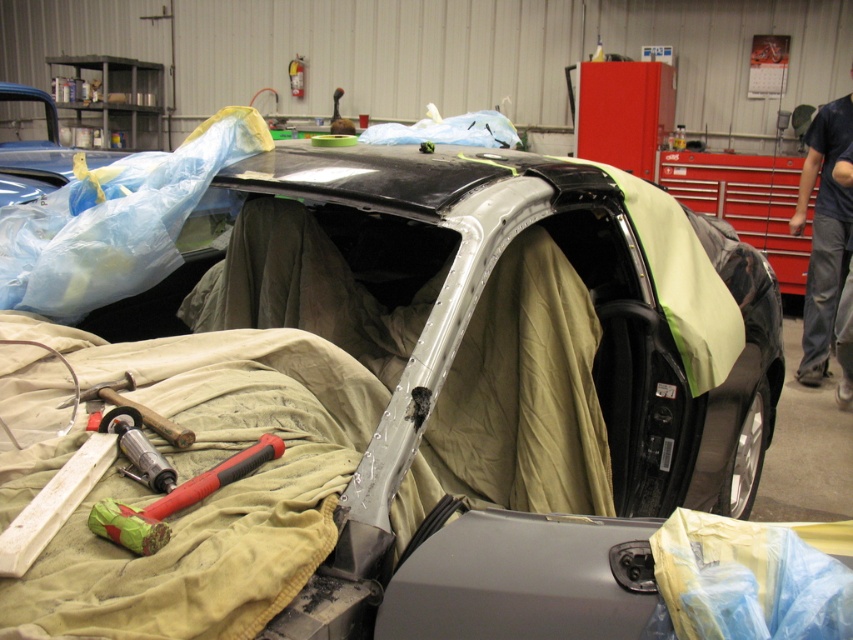
Does point (282, 205) come farther from viewer compared to point (119, 429)?

That is True.

Which is in front, point (576, 253) or point (155, 476)?

Point (155, 476)

This screenshot has height=640, width=853. Identify the location of metallic silver car at center. coord(498,314).

Can you confirm if metallic silver car at center is positioned below red rubber hammer at lower left?

No, metallic silver car at center is not below red rubber hammer at lower left.

Is point (743, 403) behind point (248, 452)?

That is True.

Based on the photo, who is more distant from viewer, (306, 260) or (140, 541)?

Positioned behind is point (306, 260).

Identify the location of metallic silver car at center. This screenshot has height=640, width=853. (498, 314).

Which is in front, point (189, 500) or point (172, 483)?

Point (189, 500)

Which is in front, point (236, 464) or point (138, 472)?

Point (138, 472) is more forward.

Identify the location of red rubber hammer at lower left. (175, 500).